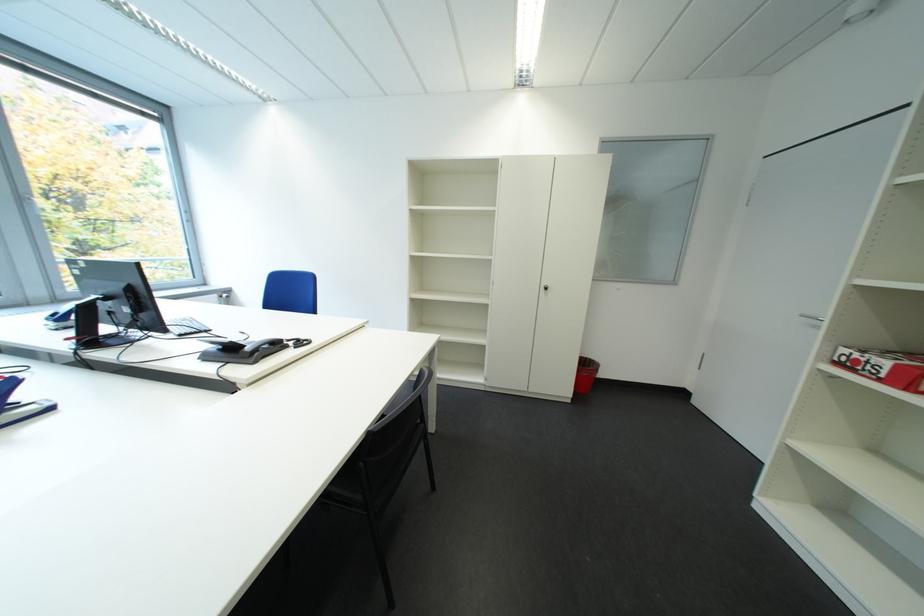
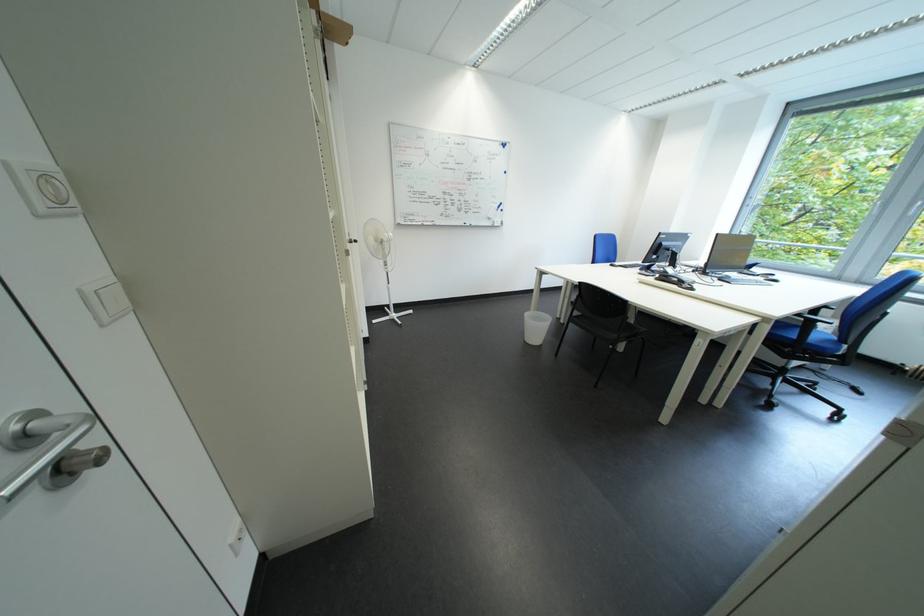
The point at (265, 365) is marked in the first image. Where is the corresponding point in the second image?

(669, 282)